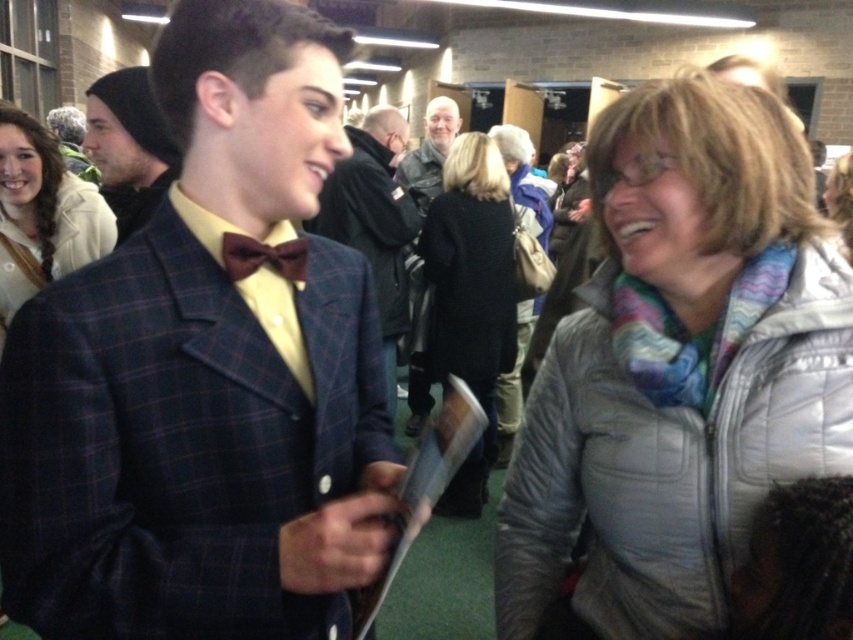
Based on the scene description, where is the gray quilted jacket located relative to the young man in the dark blue plaid blazer? Please provide coordinates in the format of a point like this example format point (679, 368).

The gray quilted jacket at right is located at point (679, 368).

You are standing in the hallway and need to locate the light brown leather jacket at upper left. According to the coordinates provided, where exactly is it positioned?

The light brown leather jacket at upper left is positioned at coordinates point (41, 214).

You are at a social event and want to approach the light brown leather jacket at upper left and the dark gray leather jacket at center. Which one should you walk towards first to reach the closest person?

You should walk towards the light brown leather jacket at upper left first because it is closer to you than the dark gray leather jacket at center.